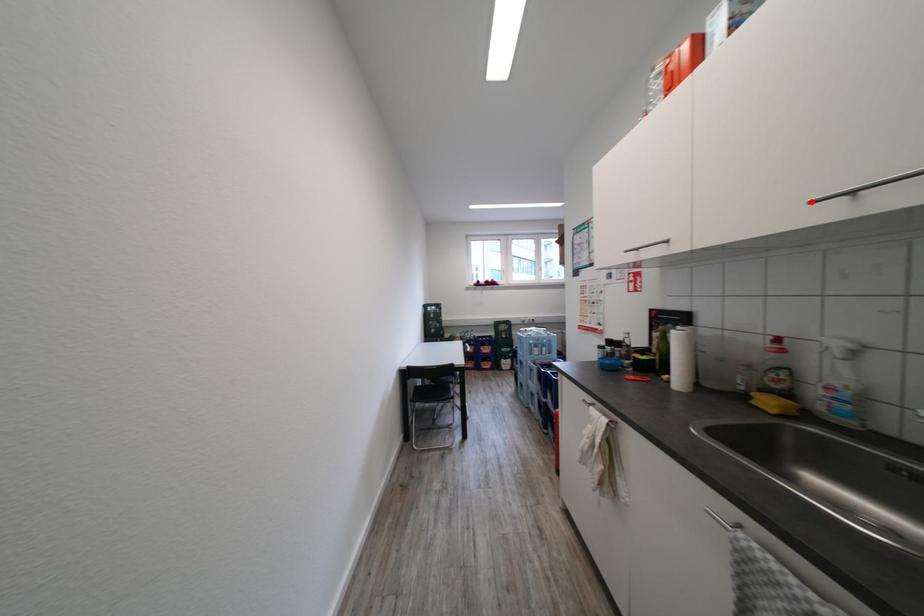
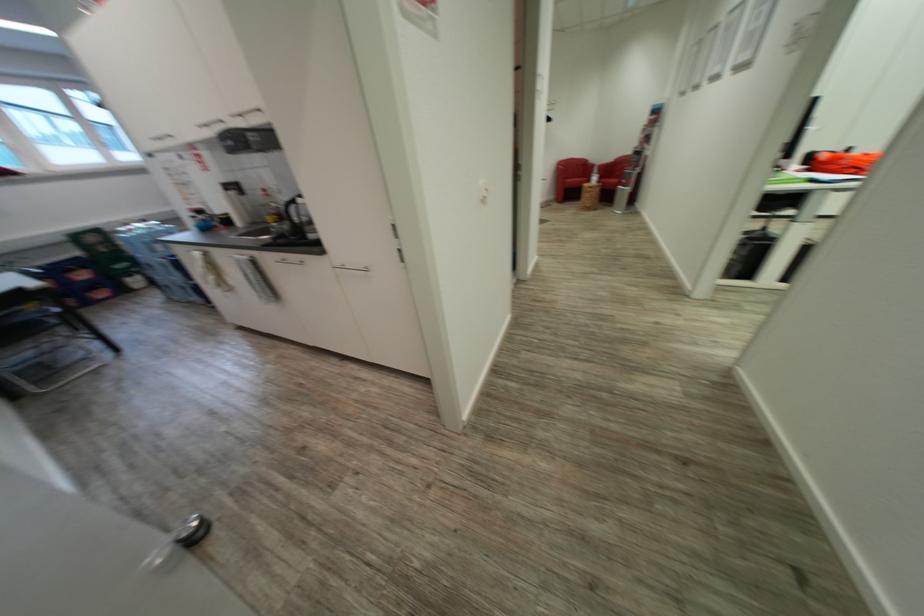
In the second image, find the point that corresponds to the highlighted location in the first image.

(198, 127)